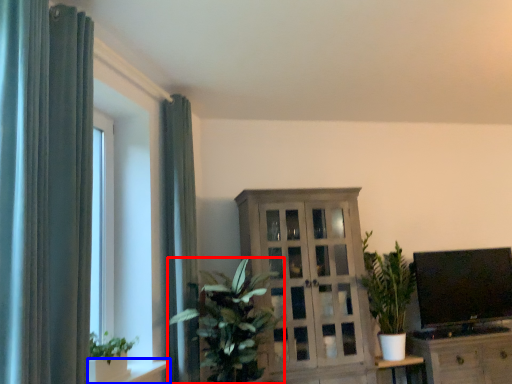
Question: Which object is closer to the camera taking this photo, houseplant (highlighted by a red box) or shelf (highlighted by a blue box)?

Choices:
 (A) houseplant
 (B) shelf

Answer: (B)